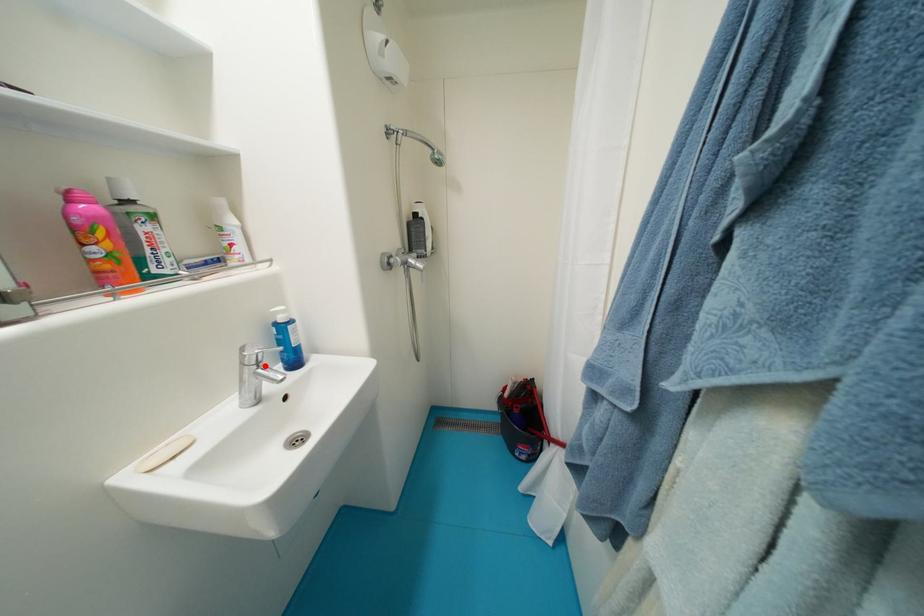
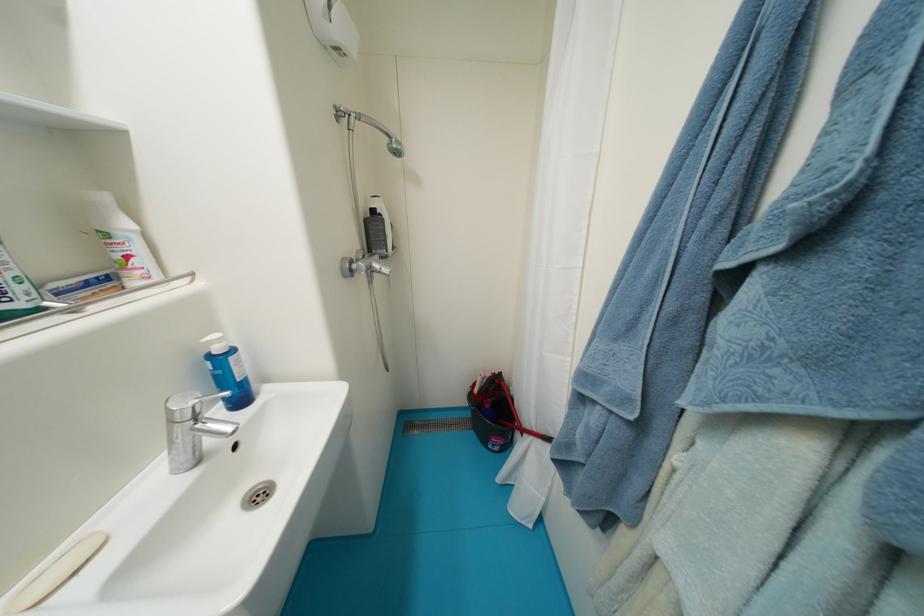
In the second image, find the point that corresponds to the highlighted location in the first image.

(203, 419)